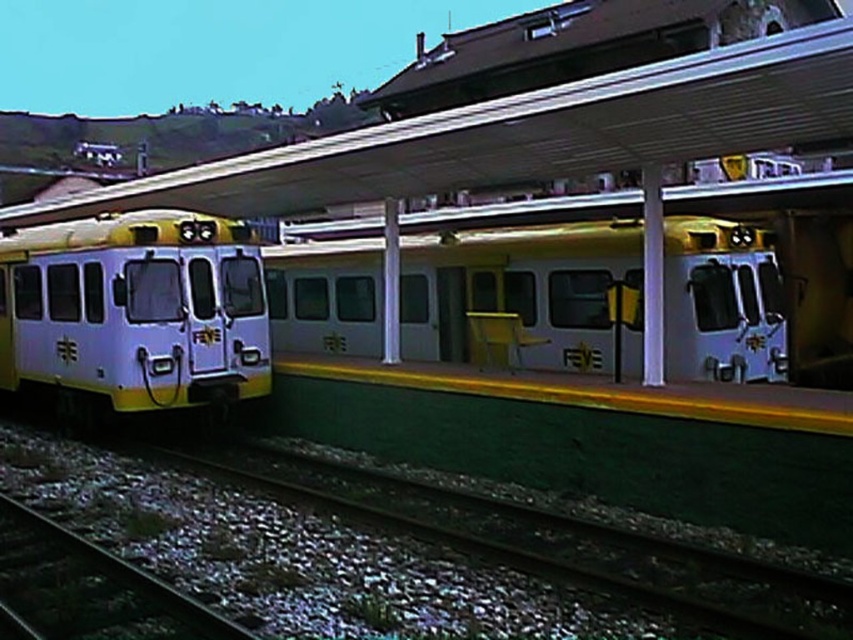
Question: Can you confirm if green gravel at lower left is positioned below dark gray metal train track at lower left?

Choices:
 (A) yes
 (B) no

Answer: (B)

Question: From the image, what is the correct spatial relationship of white glossy train at center in relation to green gravel at lower left?

Choices:
 (A) right
 (B) left

Answer: (B)

Question: Which point appears farthest from the camera in this image?

Choices:
 (A) (817, 616)
 (B) (241, 371)

Answer: (B)

Question: Which object appears farthest from the camera in this image?

Choices:
 (A) green gravel at lower left
 (B) white matte train at center

Answer: (B)

Question: Does white glossy train at center have a lesser width compared to dark gray metal train track at lower left?

Choices:
 (A) yes
 (B) no

Answer: (B)

Question: Which point is closer to the camera?

Choices:
 (A) (404, 339)
 (B) (61, 592)

Answer: (B)